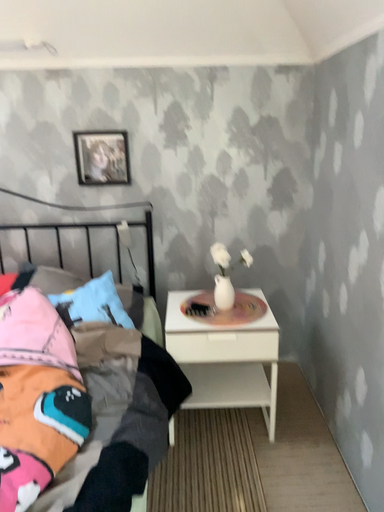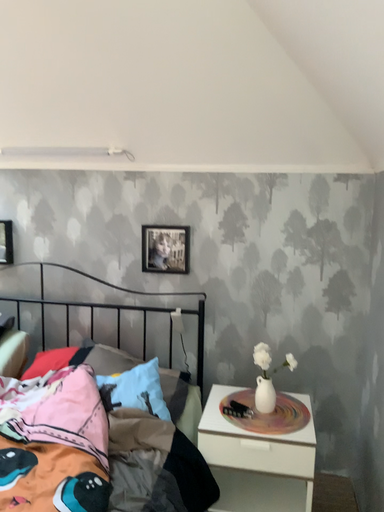
Question: How did the camera likely rotate when shooting the video?

Choices:
 (A) rotated downward
 (B) rotated upward

Answer: (B)